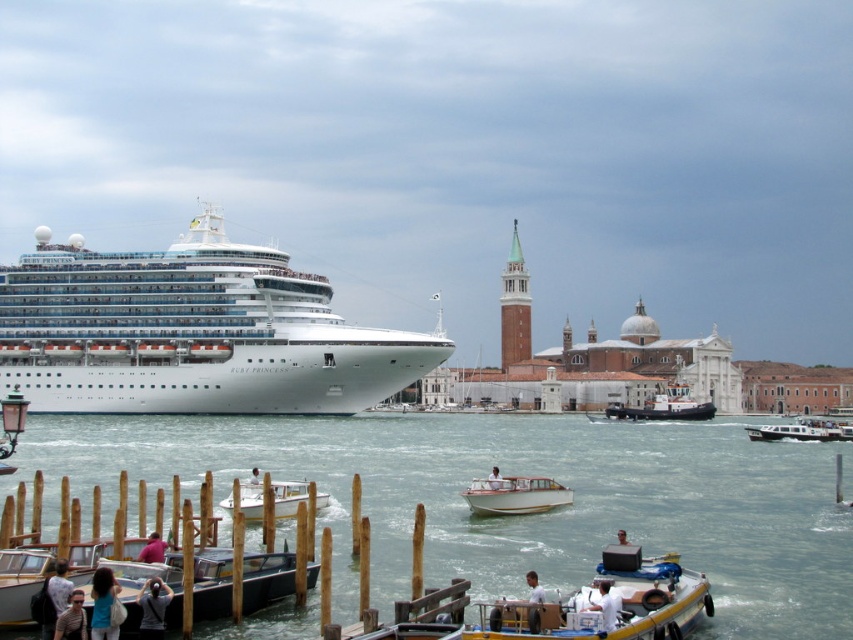
Who is more forward, (540, 596) or (253, 468)?

Point (540, 596) is more forward.

Where is `white fabric shirt at lower center`? white fabric shirt at lower center is located at coordinates (534, 588).

Which of these two, white wood boat at center or light brown wooden boat at lower center, stands shorter?

With less height is light brown wooden boat at lower center.

Is the position of white wood boat at center more distant than that of light brown wooden boat at lower center?

Yes, it is.

Does point (496, 484) come closer to viewer compared to point (618, 541)?

That is False.

The width and height of the screenshot is (853, 640). What are the coordinates of `white wood boat at center` in the screenshot? It's located at (494, 477).

Does metallic blue boat at lower center have a smaller size compared to wooden dock at lower left?

Incorrect, metallic blue boat at lower center is not smaller in size than wooden dock at lower left.

In order to click on metallic blue boat at lower center in this screenshot , I will do `click(606, 604)`.